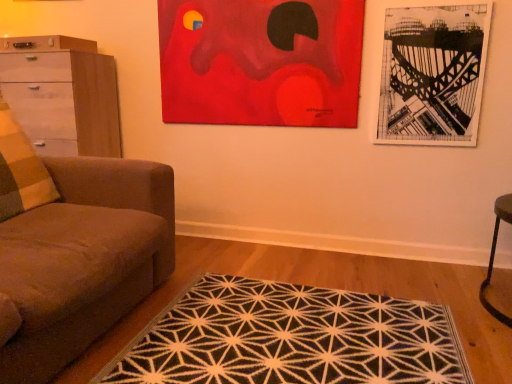
Question: Is point (247, 370) positioned closer to the camera than point (337, 84)?

Choices:
 (A) closer
 (B) farther

Answer: (A)

Question: Looking at their shapes, would you say black geometric rug at center is wider or thinner than red acrylic painting at upper center, which is counted as the 2th picture frame, starting from the right?

Choices:
 (A) thin
 (B) wide

Answer: (B)

Question: Considering the real-world distances, which object is closest to the checkered fabric pillow at left?

Choices:
 (A) red acrylic painting at upper center, which is the first picture frame in left-to-right order
 (B) black paper picture frame at upper right, acting as the first picture frame starting from the right
 (C) black geometric rug at center
 (D) white glossy chest of drawers at left
 (E) brown fabric couch at left

Answer: (E)

Question: Which is farther from the red acrylic painting at upper center, which is the first picture frame in left-to-right order?

Choices:
 (A) black paper picture frame at upper right, acting as the first picture frame starting from the right
 (B) brown fabric couch at left
 (C) checkered fabric pillow at left
 (D) white glossy chest of drawers at left
 (E) black geometric rug at center

Answer: (E)